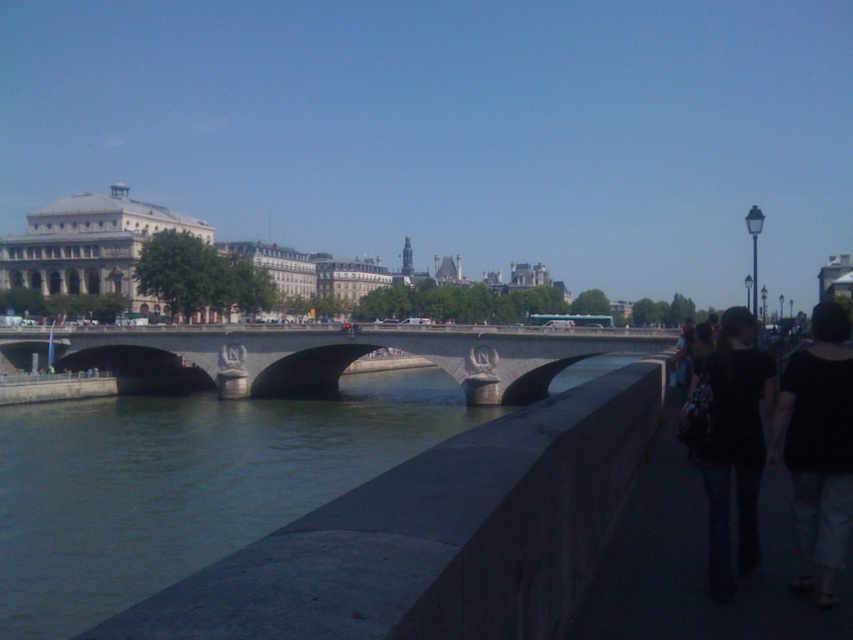
You are standing on the dark gray concrete sidewalk at lower right and want to cross to the green stone river at lower left. Is the river higher or lower than the sidewalk?

The green stone river at lower left has a greater height compared to the dark gray concrete sidewalk at lower right, so the river is higher than the sidewalk.

You are standing on the dark gray concrete sidewalk at lower right and want to cross to the other side of the green stone river at lower left. Is the river directly below the sidewalk?

The green stone river at lower left is positioned under the dark gray concrete sidewalk at lower right, so yes, the river is directly below the sidewalk.

You are standing on the paved walkway next to the black fabric backpack at lower right, and you want to cross the river using the concrete bridge at center. If your walking speed is 3 miles per hour, how many minutes will it take you to reach the other side of the bridge?

The distance between the concrete bridge at center and the black fabric backpack at lower right is 206.17 feet. Converting feet to miles, 206.17 feet is approximately 0.039 miles. At a walking speed of 3 mph, the time required would be 0.039 miles divided by 3 mph, which equals 0.013 hours. Converting hours to minutes, this is roughly 0.78 minutes, or about 47 seconds. Therefore, it will take approximately 0.8 minutes to reach the bridge and cross to the other side.